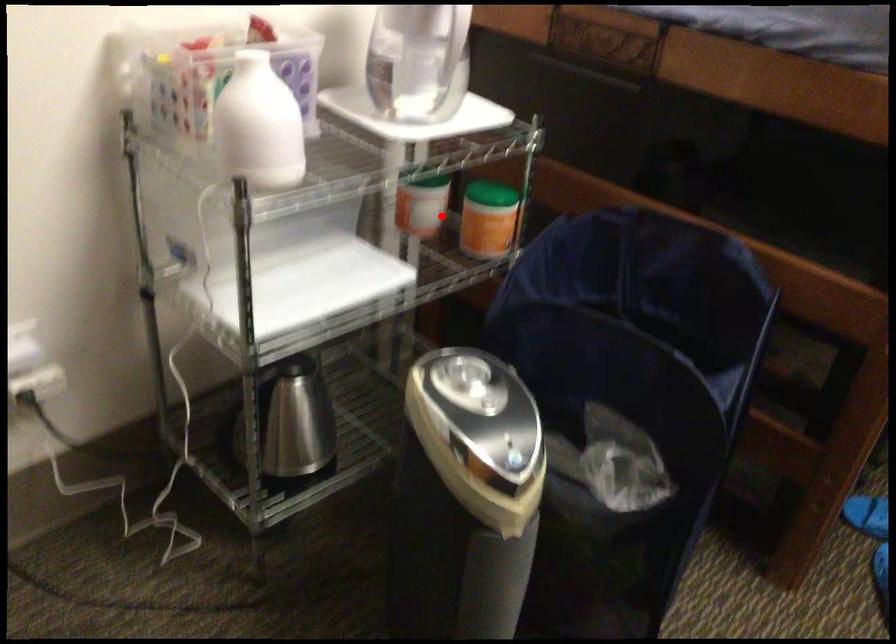
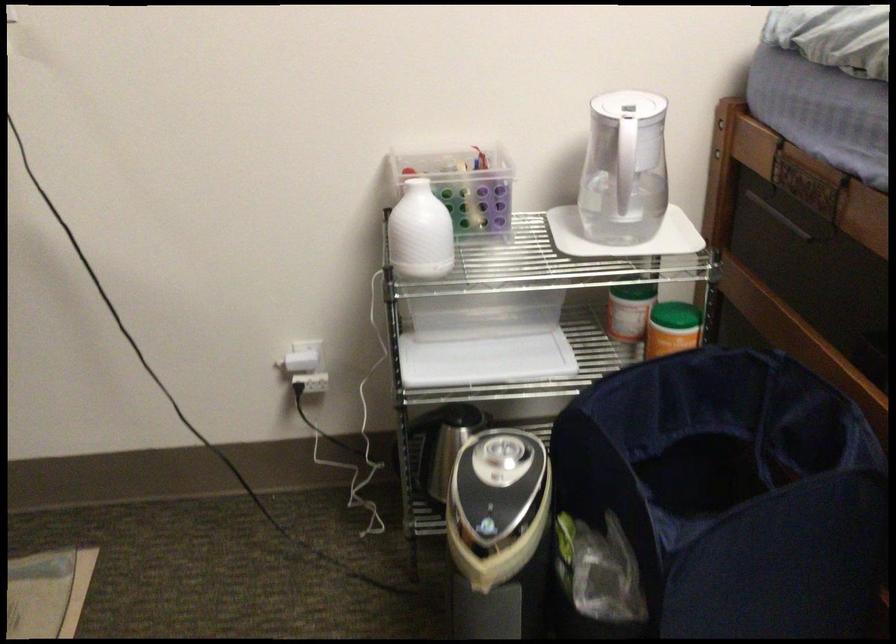
Where in the second image is the point corresponding to the highlighted location from the first image?

(635, 325)